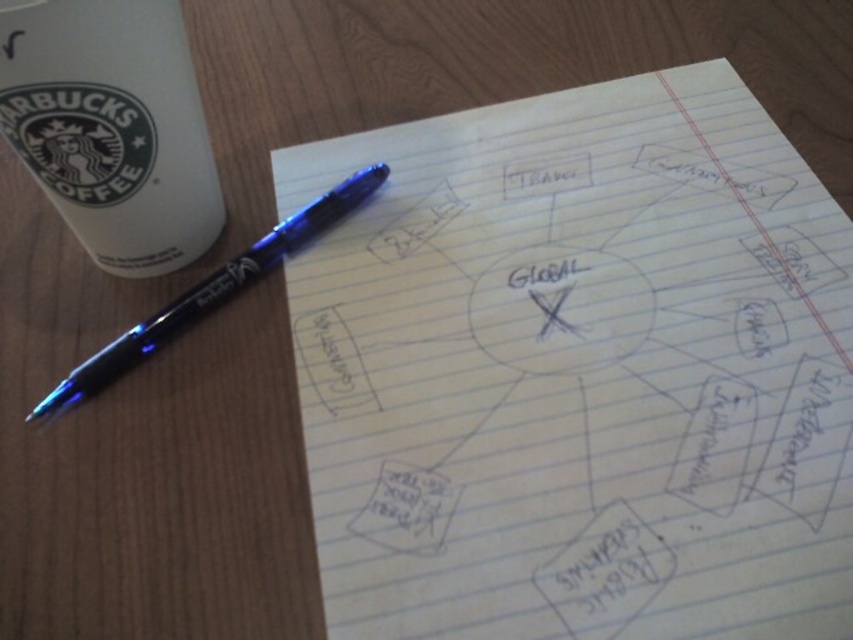
Question: Which of these objects is positioned closest to the white matte paper cup at upper left?

Choices:
 (A) blue metallic pen at upper left
 (B) white lined paper at center

Answer: (A)

Question: Does white lined paper at center have a larger size compared to blue metallic pen at upper left?

Choices:
 (A) yes
 (B) no

Answer: (A)

Question: Can you confirm if white lined paper at center is smaller than blue metallic pen at upper left?

Choices:
 (A) no
 (B) yes

Answer: (A)

Question: Is white lined paper at center positioned before blue metallic pen at upper left?

Choices:
 (A) yes
 (B) no

Answer: (A)

Question: Which object appears farthest from the camera in this image?

Choices:
 (A) white matte paper cup at upper left
 (B) blue metallic pen at upper left

Answer: (B)

Question: Among these points, which one is farthest from the camera?

Choices:
 (A) (38, 84)
 (B) (79, 397)

Answer: (B)